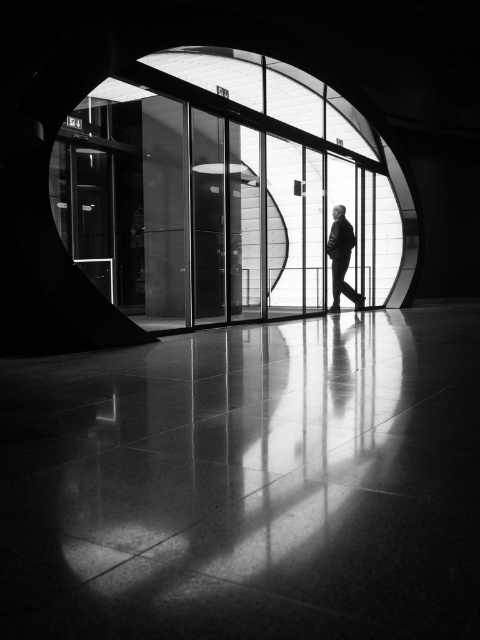
Between transparent glass door at center and silhouette suit at center, which one appears on the right side from the viewer's perspective?

Positioned to the right is silhouette suit at center.

Which is below, transparent glass door at center or silhouette suit at center?

silhouette suit at center is lower down.

What do you see at coordinates (222, 192) in the screenshot?
I see `transparent glass door at center` at bounding box center [222, 192].

This screenshot has width=480, height=640. Find the location of `transparent glass door at center`. transparent glass door at center is located at coordinates point(222,192).